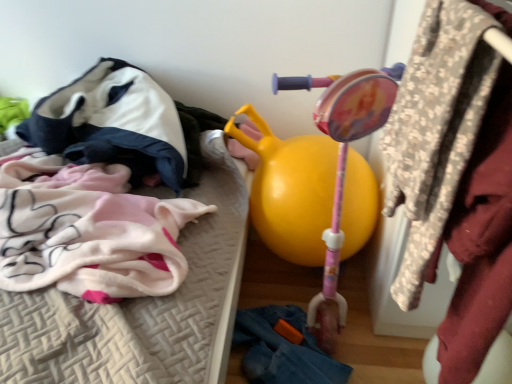
Question: Is denim at lower right, which is the second clothing from top to bottom, surrounded by floral fabric coat at upper right?

Choices:
 (A) yes
 (B) no

Answer: (B)

Question: Is denim at lower right, arranged as the second clothing when viewed from the left, at the back of floral fabric coat at upper right?

Choices:
 (A) no
 (B) yes

Answer: (A)

Question: Considering the relative sizes of floral fabric coat at upper right and denim at lower right, placed as the 1th clothing when sorted from bottom to top, in the image provided, is floral fabric coat at upper right taller than denim at lower right, placed as the 1th clothing when sorted from bottom to top,?

Choices:
 (A) no
 (B) yes

Answer: (B)

Question: Does floral fabric coat at upper right appear on the right side of denim at lower right, arranged as the second clothing when viewed from the left?

Choices:
 (A) no
 (B) yes

Answer: (B)

Question: Can you confirm if floral fabric coat at upper right is shorter than denim at lower right, which is the second clothing from top to bottom?

Choices:
 (A) yes
 (B) no

Answer: (B)

Question: In the image, is soft pink fabric blanket at left positioned in front of or behind yellow rubber ball at center?

Choices:
 (A) behind
 (B) front

Answer: (B)

Question: From a real-world perspective, is soft pink fabric blanket at left physically located above or below yellow rubber ball at center?

Choices:
 (A) above
 (B) below

Answer: (A)

Question: Is soft pink fabric blanket at left inside or outside of yellow rubber ball at center?

Choices:
 (A) outside
 (B) inside

Answer: (A)

Question: Visually, is soft pink fabric blanket at left positioned to the left or to the right of yellow rubber ball at center?

Choices:
 (A) right
 (B) left

Answer: (B)

Question: Is velvet-like hoodie at upper left, the first clothing viewed from the left, spatially inside yellow rubber ball at center, or outside of it?

Choices:
 (A) inside
 (B) outside

Answer: (B)

Question: From their relative heights in the image, would you say velvet-like hoodie at upper left, the 2th clothing from the bottom, is taller or shorter than yellow rubber ball at center?

Choices:
 (A) short
 (B) tall

Answer: (A)

Question: Is velvet-like hoodie at upper left, which appears as the 1th clothing when viewed from the top, bigger or smaller than yellow rubber ball at center?

Choices:
 (A) big
 (B) small

Answer: (A)

Question: Relative to yellow rubber ball at center, is velvet-like hoodie at upper left, which appears as the 1th clothing when viewed from the top, in front or behind?

Choices:
 (A) front
 (B) behind

Answer: (B)

Question: Looking at their shapes, would you say velvet-like hoodie at upper left, the 2th clothing from the bottom, is wider or thinner than floral fabric coat at upper right?

Choices:
 (A) wide
 (B) thin

Answer: (A)

Question: From the image's perspective, is velvet-like hoodie at upper left, arranged as the second clothing when viewed from the right, positioned above or below floral fabric coat at upper right?

Choices:
 (A) above
 (B) below

Answer: (A)